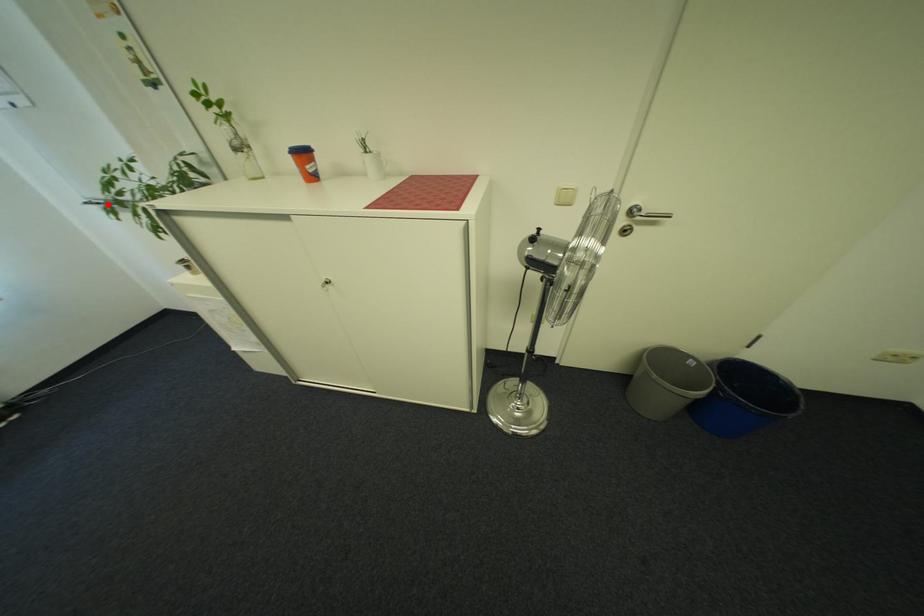
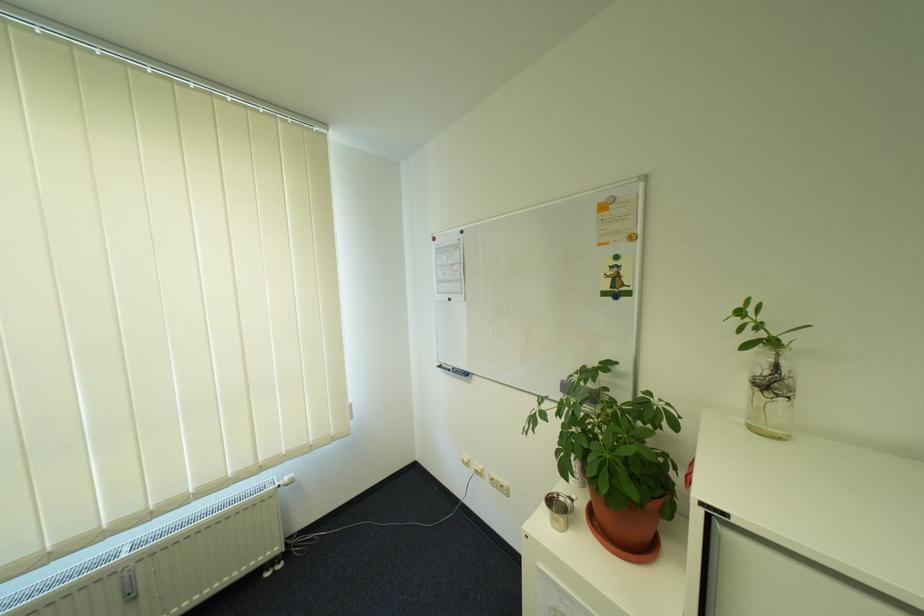
Locate, in the second image, the point that corresponds to the highlighted location in the first image.

(458, 371)